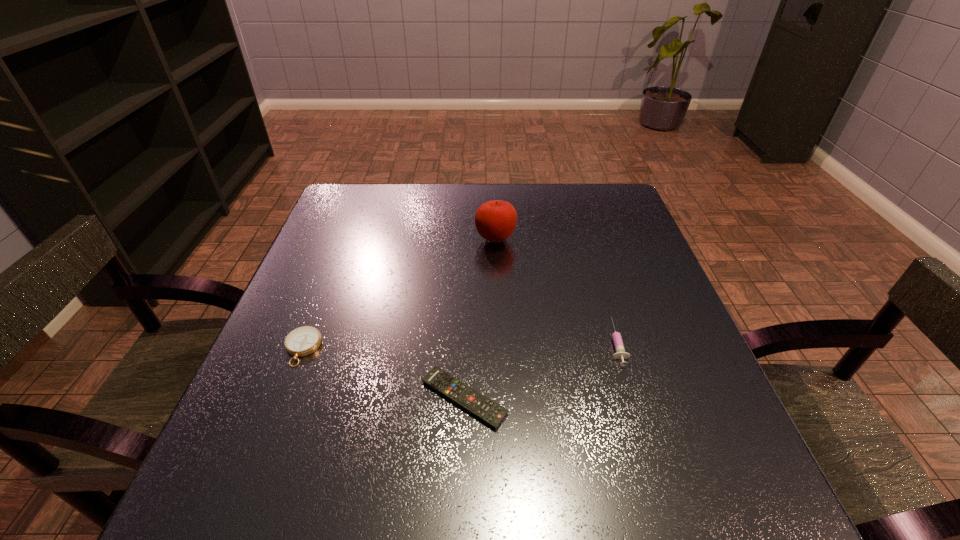
Identify the location of free location located on the back of the compass. This screenshot has width=960, height=540. (328, 281).

Image resolution: width=960 pixels, height=540 pixels. I want to click on vacant space located on the back of the remote control, so 468,268.

The width and height of the screenshot is (960, 540). In order to click on object positioned at the far edge in this screenshot , I will do `click(495, 221)`.

The image size is (960, 540). I want to click on object situated at the left edge, so click(304, 340).

What are the coordinates of `object located in the right edge section of the desktop` in the screenshot? It's located at (620, 353).

Where is `vacant position at the far edge of the desktop`? The height and width of the screenshot is (540, 960). vacant position at the far edge of the desktop is located at coordinates (474, 217).

In the image, there is a desktop. Identify the location of blank space at the near edge. The width and height of the screenshot is (960, 540). (647, 520).

Locate an element on the screen. The width and height of the screenshot is (960, 540). free space at the left edge of the desktop is located at coordinates (300, 278).

The height and width of the screenshot is (540, 960). Find the location of `free region at the right edge of the desktop`. free region at the right edge of the desktop is located at coordinates (663, 319).

In the image, there is a desktop. Identify the location of vacant space at the near left corner. (263, 492).